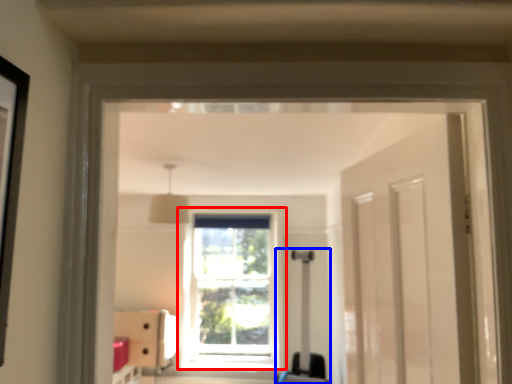
Question: Which point is closer to the camera, window (highlighted by a red box) or luggage (highlighted by a blue box)?

Choices:
 (A) window
 (B) luggage

Answer: (B)